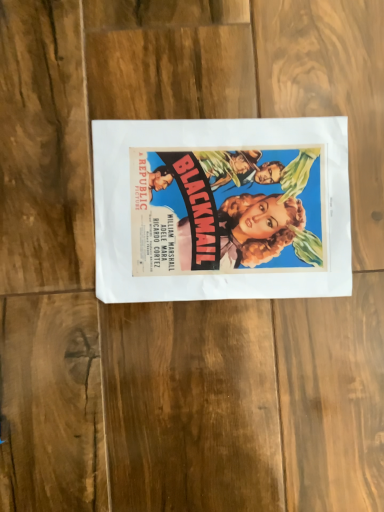
This screenshot has width=384, height=512. I want to click on free point above matte paper poster at center (from a real-world perspective), so click(218, 206).